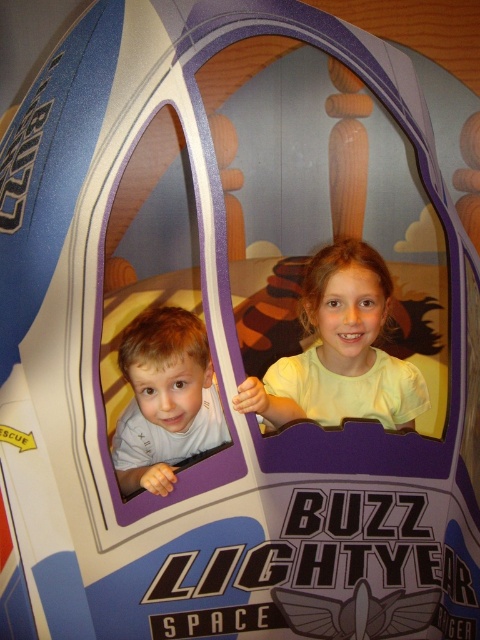
You are a photographer standing outside the Buzz Lightyear play structure. You want to take a photo of the two children inside through the rounded window. The camera can only focus on objects wider than 30 cm. Based on the scene, will both the light yellow shirt at center and the light brown hair at left be in focus?

The light yellow shirt at center is wider than the light brown hair at left. Since the camera focuses on objects wider than 30 cm, we need to know the exact width of each. However, the description only states the shirt is wider than the hair but doesn

You are a photographer trying to capture a clear photo of both the light yellow shirt at center and the light brown hair at left. Since you want to focus on the smaller object, which one should you adjust your camera to focus on?

The light brown hair at left is smaller than the light yellow shirt at center, so you should adjust your camera to focus on the light brown hair at left.

You are a photographer positioned outside the spaceship play structure. You want to capture a photo of both children so that the light yellow shirt at center and the light brown hair at left are clearly visible. Based on their positions, which child should you focus on first to ensure both are in frame?

You should focus on the light brown hair at left first because the light yellow shirt at center is to the right of it, ensuring both will be in frame when starting from the left side.